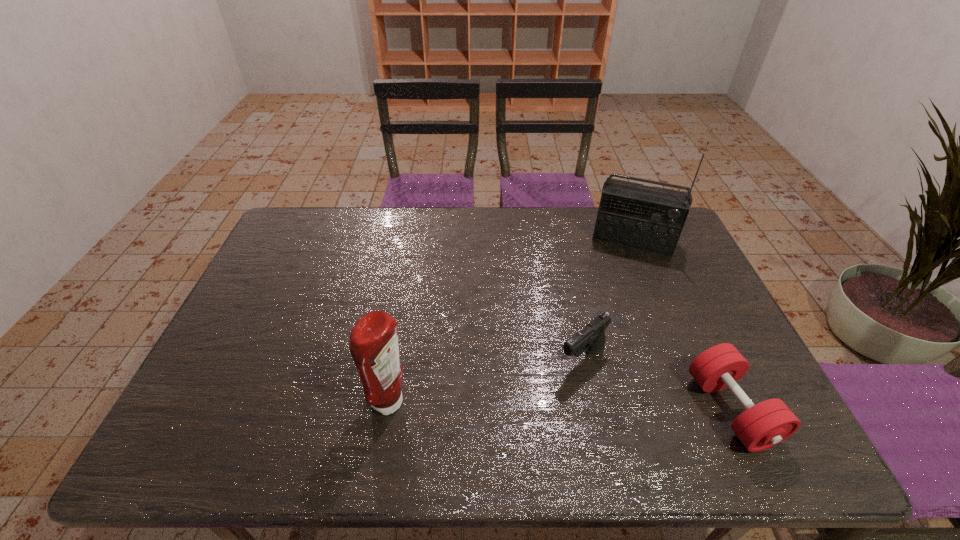
Image resolution: width=960 pixels, height=540 pixels. I want to click on vacant space that's between the pistol and the dumbbell, so click(x=657, y=384).

This screenshot has height=540, width=960. In order to click on vacant area between the dumbbell and the leftmost object in this screenshot , I will do `click(561, 406)`.

You are a GUI agent. You are given a task and a screenshot of the screen. Output one action in this format:
    pyautogui.click(x=<x>, y=<y>)
    Task: Click on the vacant region between the farthest object and the second object from left to right
    The image size is (960, 540).
    Given the screenshot: What is the action you would take?
    pyautogui.click(x=608, y=299)

The image size is (960, 540). I want to click on free area in between the farthest object and the condiment, so (x=512, y=321).

At what (x,y) coordinates should I click in order to perform the action: click on unoccupied area between the farthest object and the third object from right to left. Please return your answer as a coordinate pair (x, y). Looking at the image, I should click on (608, 299).

Identify the location of vacant area between the dumbbell and the pistol. The image size is (960, 540). (657, 384).

At what (x,y) coordinates should I click in order to perform the action: click on free space between the leftmost object and the farthest object. Please return your answer as a coordinate pair (x, y). This screenshot has height=540, width=960. Looking at the image, I should click on (512, 321).

Where is `object that is the third closest one to the pistol`? This screenshot has height=540, width=960. object that is the third closest one to the pistol is located at coordinates (374, 347).

The width and height of the screenshot is (960, 540). I want to click on object that can be found as the second closest to the second tallest object, so click(761, 426).

Where is `blank space that satisfies the following two spatial constraints: 1. on the back side of the second tallest object; 2. on the right side of the tallest object`? This screenshot has height=540, width=960. blank space that satisfies the following two spatial constraints: 1. on the back side of the second tallest object; 2. on the right side of the tallest object is located at coordinates (418, 240).